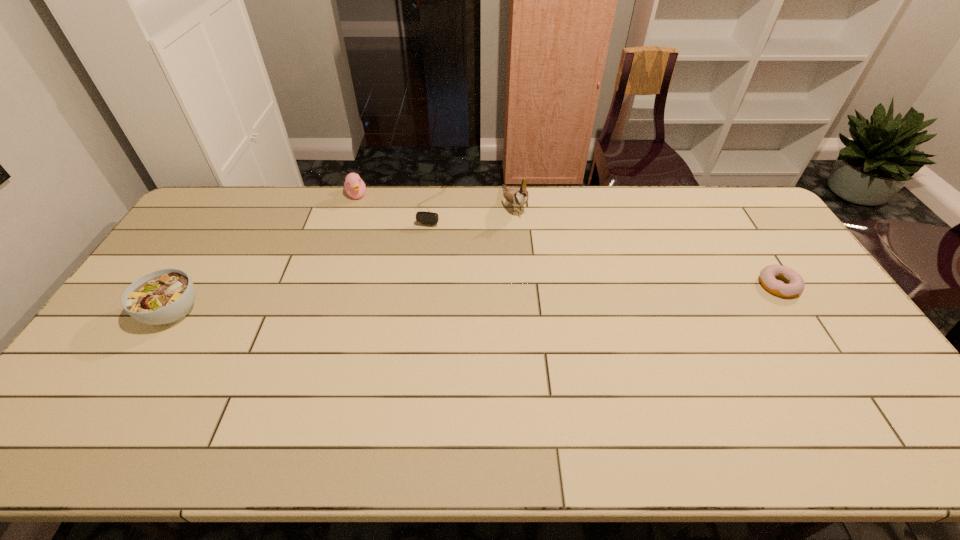
What are the coordinates of `vacant area situated on the front-facing side of the third object from left to right` in the screenshot? It's located at (405, 287).

Locate an element on the screen. Image resolution: width=960 pixels, height=540 pixels. free region located on the front-facing side of the third object from left to right is located at coordinates (412, 268).

This screenshot has height=540, width=960. Find the location of `blank area located 0.140m on the front-facing side of the third object from left to right`. blank area located 0.140m on the front-facing side of the third object from left to right is located at coordinates (x=417, y=255).

You are a GUI agent. You are given a task and a screenshot of the screen. Output one action in this format:
    pyautogui.click(x=<x>, y=<y>)
    Task: Click on the vacant space located 0.140m on the front-facing side of the fourth object from right to left
    This screenshot has height=540, width=960.
    Given the screenshot: What is the action you would take?
    pyautogui.click(x=371, y=225)

The height and width of the screenshot is (540, 960). In order to click on vacant position located on the front-facing side of the fourth object from right to left in this screenshot , I will do `click(370, 221)`.

Locate an element on the screen. The height and width of the screenshot is (540, 960). vacant space located 0.100m on the front-facing side of the fourth object from right to left is located at coordinates (368, 219).

Where is `vacant position located 0.210m at the face of the fourth object from left to right`? The height and width of the screenshot is (540, 960). vacant position located 0.210m at the face of the fourth object from left to right is located at coordinates (542, 265).

Image resolution: width=960 pixels, height=540 pixels. I want to click on vacant space located at the face of the fourth object from left to right, so click(x=566, y=308).

Where is `vacant area situated at the face of the fourth object from left to right`? This screenshot has width=960, height=540. vacant area situated at the face of the fourth object from left to right is located at coordinates (555, 287).

You are a GUI agent. You are given a task and a screenshot of the screen. Output one action in this format:
    pyautogui.click(x=<x>, y=<y>)
    Task: Click on the webcam situated at the far edge
    
    Given the screenshot: What is the action you would take?
    pyautogui.click(x=432, y=218)